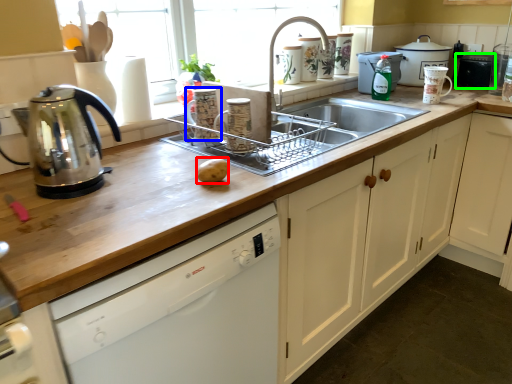
Question: Which object is the farthest from potato (highlighted by a red box)? Choose among these: appliance (highlighted by a blue box) or appliance (highlighted by a green box).

Choices:
 (A) appliance
 (B) appliance

Answer: (B)